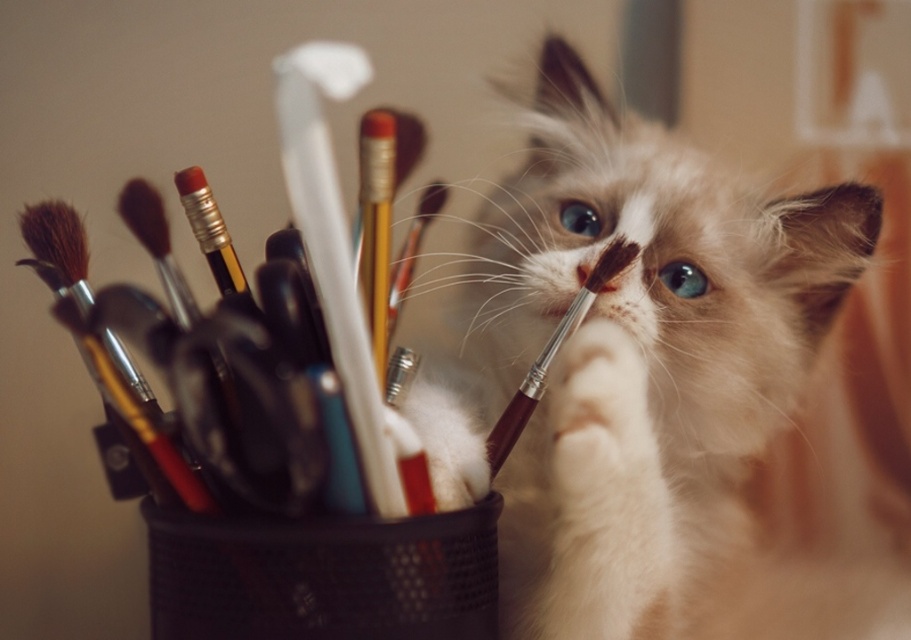
Where is the white fluffy cat at center located in the image?

The white fluffy cat at center is located at point 0.600 in the x coordinate and 0.708 in the y coordinate.

You are an art supply organizer trying to retrieve the brown wooden paint brush at center from the scene. The white fluffy cat at center is blocking your access. Can you move the cat to get the brush?

The white fluffy cat at center is positioned over the brown wooden paint brush at center, so you cannot retrieve the brush without moving the cat first.

You are an artist who needs to choose between placing a new small sculpture on the white fluffy cat at center or the brown wooden paint brush at center. Based on their sizes, which object can better support the sculpture without getting overwhelmed?

The white fluffy cat at center has a larger width than the brown wooden paint brush at center, so it can better support the sculpture without getting overwhelmed.